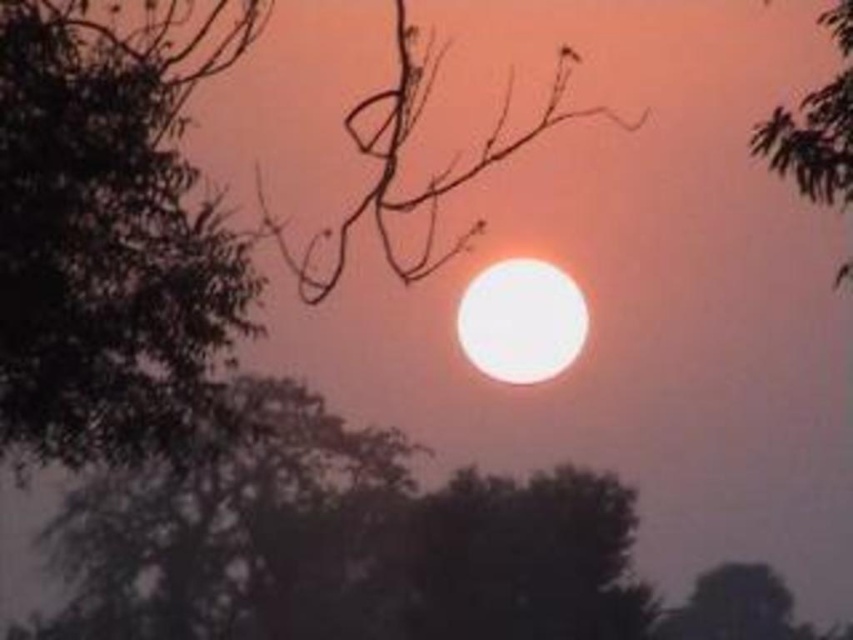
Does green leafy tree at left have a smaller size compared to dark green leafy tree at lower left?

Correct, green leafy tree at left occupies less space than dark green leafy tree at lower left.

Is point (122, 289) behind point (309, 396)?

No, (122, 289) is closer to viewer.

Does point (161, 38) come behind point (77, 605)?

No.

What are the coordinates of `green leafy tree at left` in the screenshot? It's located at (103, 240).

Is dark green leafy tree at lower left in front of green leafy tree at upper right?

No, it is behind green leafy tree at upper right.

Who is more distant from viewer, (277, 588) or (766, 150)?

Positioned behind is point (277, 588).

The image size is (853, 640). What do you see at coordinates (218, 520) in the screenshot?
I see `dark green leafy tree at lower left` at bounding box center [218, 520].

This screenshot has width=853, height=640. I want to click on dark green leafy tree at lower left, so click(x=218, y=520).

Who is taller, brown matte branch at center or green leafy tree at upper right?

Standing taller between the two is brown matte branch at center.

Can you confirm if brown matte branch at center is bigger than green leafy tree at upper right?

Yes.

Who is more distant from viewer, [566,68] or [827,92]?

Positioned behind is point [566,68].

What are the coordinates of `brown matte branch at center` in the screenshot? It's located at (398, 154).